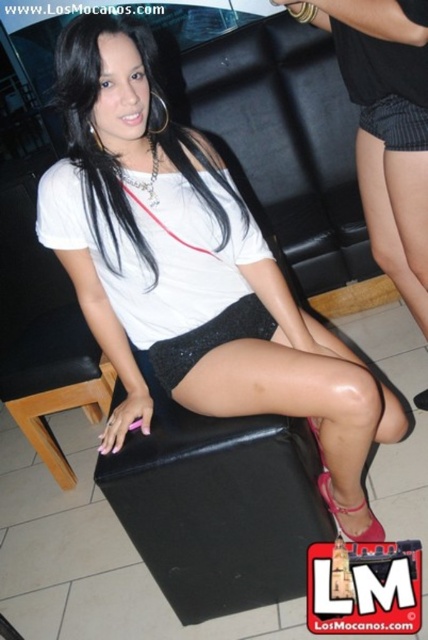
Question: Does shiny black shorts at center have a greater width compared to black sequined skirt at center?

Choices:
 (A) no
 (B) yes

Answer: (B)

Question: Estimate the real-world distances between objects in this image. Which object is closer to the black sequined skirt at center?

Choices:
 (A) shiny pink sandal at lower right
 (B) black leather stool at center

Answer: (B)

Question: Does shiny black shorts at center have a smaller size compared to shiny pink sandal at lower right?

Choices:
 (A) no
 (B) yes

Answer: (A)

Question: Which point is closer to the camera?

Choices:
 (A) shiny black shorts at center
 (B) black leather stool at center

Answer: (A)

Question: Among these points, which one is nearest to the camera?

Choices:
 (A) (321, 476)
 (B) (383, 424)
 (C) (258, 326)
 (D) (267, 476)

Answer: (D)

Question: Where is shiny black shorts at center located in relation to black sequined skirt at center in the image?

Choices:
 (A) above
 (B) below

Answer: (B)